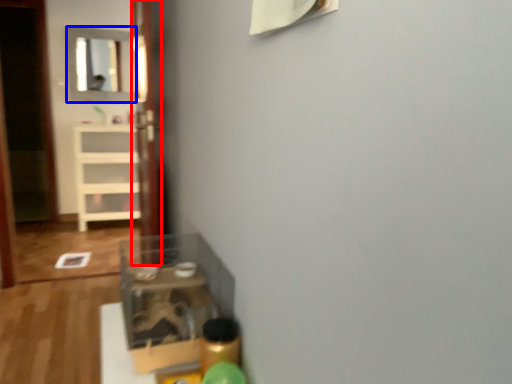
Question: Which of the following is the closest to the observer, glass door (highlighted by a red box) or mirror (highlighted by a blue box)?

Choices:
 (A) glass door
 (B) mirror

Answer: (A)